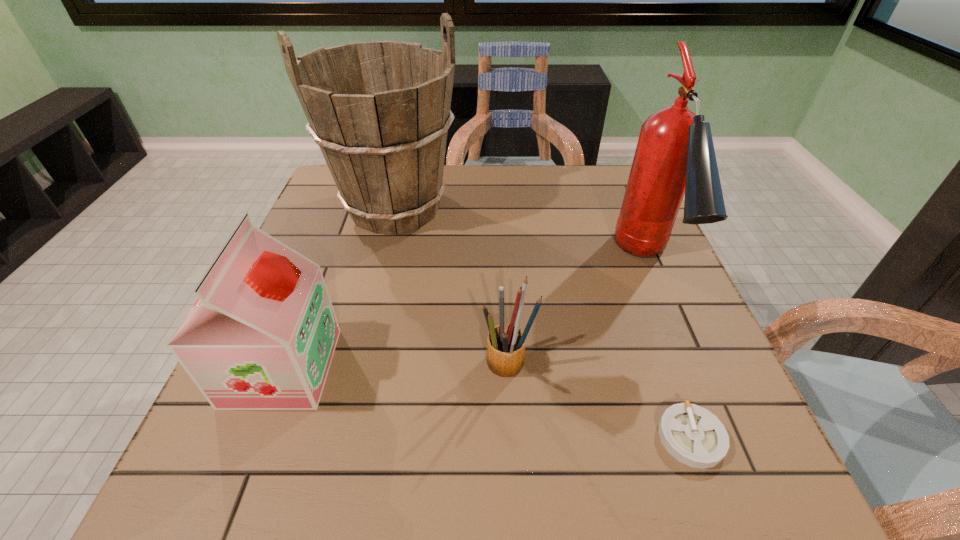
In the image, there is a desktop. At what (x,y) coordinates should I click in order to perform the action: click on vacant space at the near edge. Please return your answer as a coordinate pair (x, y). Looking at the image, I should click on (298, 461).

At what (x,y) coordinates should I click in order to perform the action: click on vacant space at the left edge of the desktop. Please return your answer as a coordinate pair (x, y). This screenshot has height=540, width=960. Looking at the image, I should click on (298, 241).

In the image, there is a desktop. Where is `vacant space at the right edge`? vacant space at the right edge is located at coordinates (676, 384).

You are a GUI agent. You are given a task and a screenshot of the screen. Output one action in this format:
    pyautogui.click(x=<x>, y=<y>)
    Task: Click on the vacant region at the near left corner of the desktop
    
    Given the screenshot: What is the action you would take?
    pyautogui.click(x=274, y=495)

Identify the location of vacant space at the far right corner of the desktop. The width and height of the screenshot is (960, 540). (583, 190).

What are the coordinates of `vacant area at the near right corner` in the screenshot? It's located at (738, 494).

Where is `free space between the pencil box and the ashtray`? free space between the pencil box and the ashtray is located at coordinates (600, 401).

Locate an element on the screen. The image size is (960, 540). free space between the ashtray and the fire extinguisher is located at coordinates (669, 350).

This screenshot has height=540, width=960. In order to click on empty space between the soya milk and the ashtray in this screenshot , I will do `click(487, 402)`.

Locate an element on the screen. free spot between the fourth tallest object and the bucket is located at coordinates (452, 287).